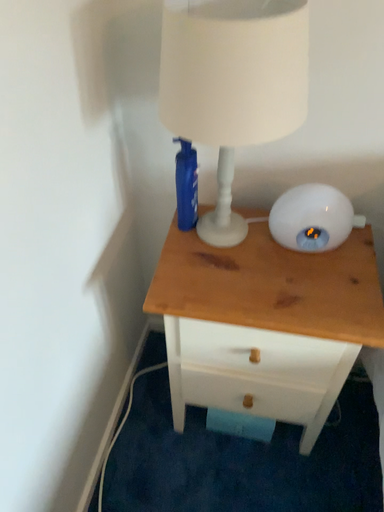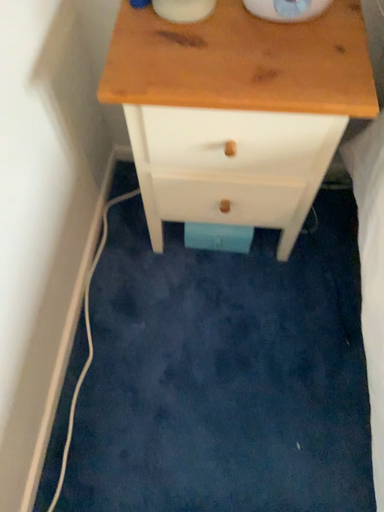
Question: How did the camera likely rotate when shooting the video?

Choices:
 (A) rotated upward
 (B) rotated downward

Answer: (B)